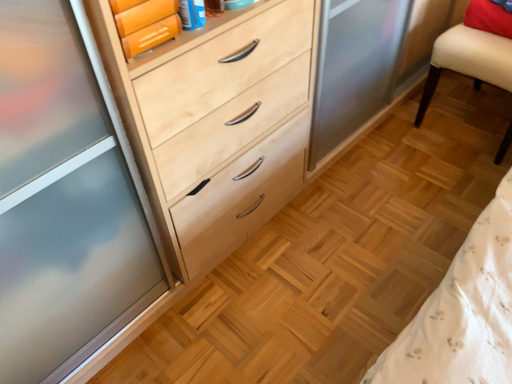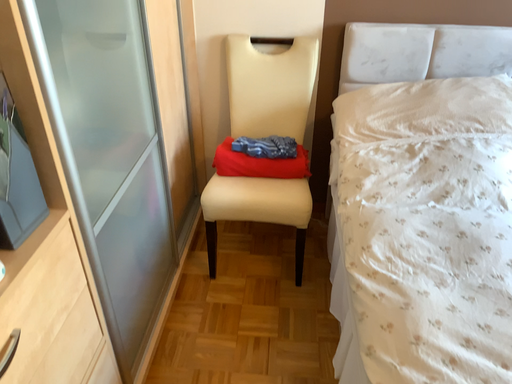
Question: Which way did the camera rotate in the video?

Choices:
 (A) rotated right
 (B) rotated left

Answer: (A)